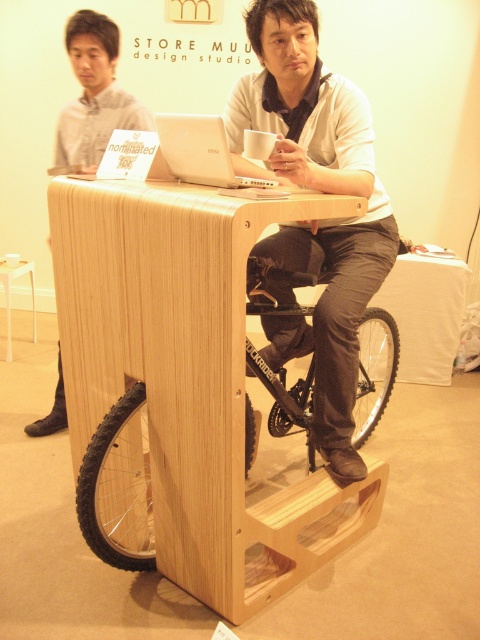
Who is taller, white wood stool at lower left or white matte cup at center?

white wood stool at lower left

This screenshot has width=480, height=640. What do you see at coordinates (10, 292) in the screenshot?
I see `white wood stool at lower left` at bounding box center [10, 292].

Between point (13, 268) and point (275, 144), which one is positioned behind?

The point (13, 268) is behind.

This screenshot has width=480, height=640. In order to click on white wood stool at lower left in this screenshot , I will do `click(10, 292)`.

Between white matte laptop at center and white matte cup at center, which one is positioned lower?

white matte laptop at center is lower down.

Is the position of white matte laptop at center less distant than that of white matte cup at center?

Yes, white matte laptop at center is in front of white matte cup at center.

Locate an element on the screen. white matte laptop at center is located at coordinates (200, 150).

Is light wood table at center to the left of white matte laptop at center from the viewer's perspective?

Correct, you'll find light wood table at center to the left of white matte laptop at center.

Is light wood table at center further to camera compared to white matte laptop at center?

That is False.

Is point (301, 214) behind point (232, 182)?

No.

At what (x,y) coordinates should I click in order to perform the action: click on light wood table at center. Please return your answer as a coordinate pair (x, y). Image resolution: width=480 pixels, height=640 pixels. Looking at the image, I should click on (133, 337).